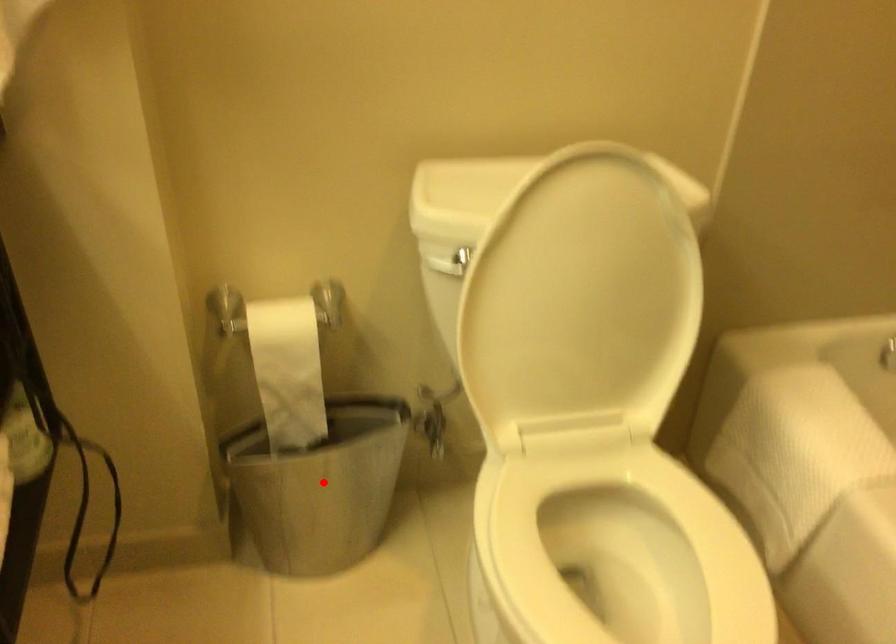
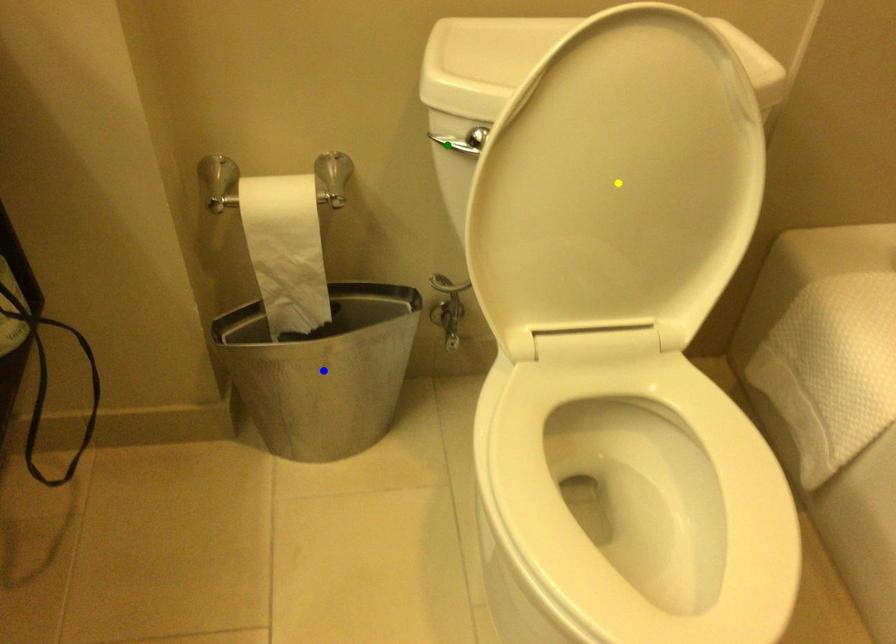
Question: I am providing you with two images of the same scene from different viewpoints. A red point is marked on the first image. You are given multiple points on the second image. Can you choose the point in image 2 that corresponds to the point in image 1?

Choices:
 (A) green point
 (B) yellow point
 (C) blue point

Answer: (C)